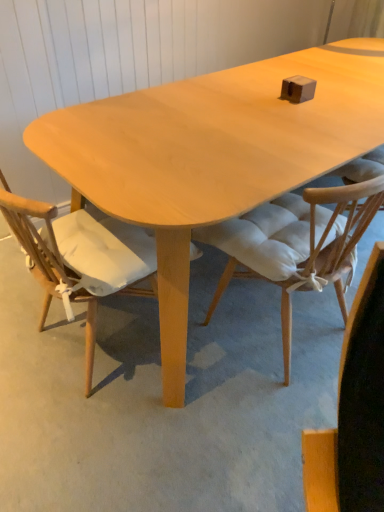
Question: From a real-world perspective, is light wood chair at center, which is the 2th chair in right-to-left order, above or below white padded chair at center, which appears as the 1th chair when viewed from the right?

Choices:
 (A) below
 (B) above

Answer: (B)

Question: In the image, is light wood chair at center, the 1th chair from the left, positioned in front of or behind white padded chair at center, placed as the 2th chair when sorted from left to right?

Choices:
 (A) behind
 (B) front

Answer: (B)

Question: From the image's perspective, is light wood chair at center, which is the 2th chair in right-to-left order, above or below white padded chair at center, placed as the 2th chair when sorted from left to right?

Choices:
 (A) above
 (B) below

Answer: (B)

Question: Would you say white padded chair at center, which appears as the 1th chair when viewed from the right, is inside or outside light wood chair at center, which is the 2th chair in right-to-left order?

Choices:
 (A) inside
 (B) outside

Answer: (B)

Question: Looking at their shapes, would you say white padded chair at center, placed as the 2th chair when sorted from left to right, is wider or thinner than light wood chair at center, the 1th chair from the left?

Choices:
 (A) thin
 (B) wide

Answer: (A)

Question: In the image, is white padded chair at center, placed as the 2th chair when sorted from left to right, positioned in front of or behind light wood chair at center, the 1th chair from the left?

Choices:
 (A) behind
 (B) front

Answer: (A)

Question: Would you say white padded chair at center, which appears as the 1th chair when viewed from the right, is to the left or to the right of light wood chair at center, the 1th chair from the left, in the picture?

Choices:
 (A) left
 (B) right

Answer: (B)